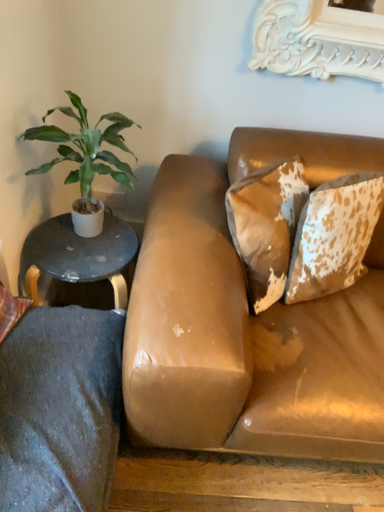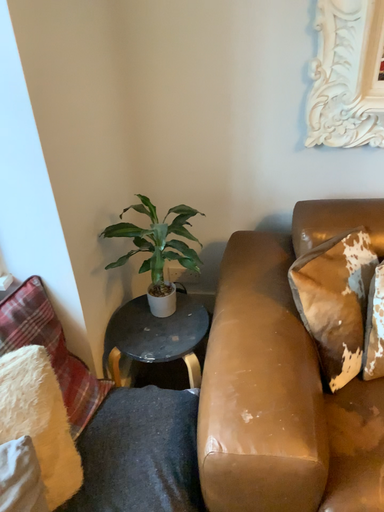
Question: Which way did the camera rotate in the video?

Choices:
 (A) rotated right
 (B) rotated left

Answer: (B)